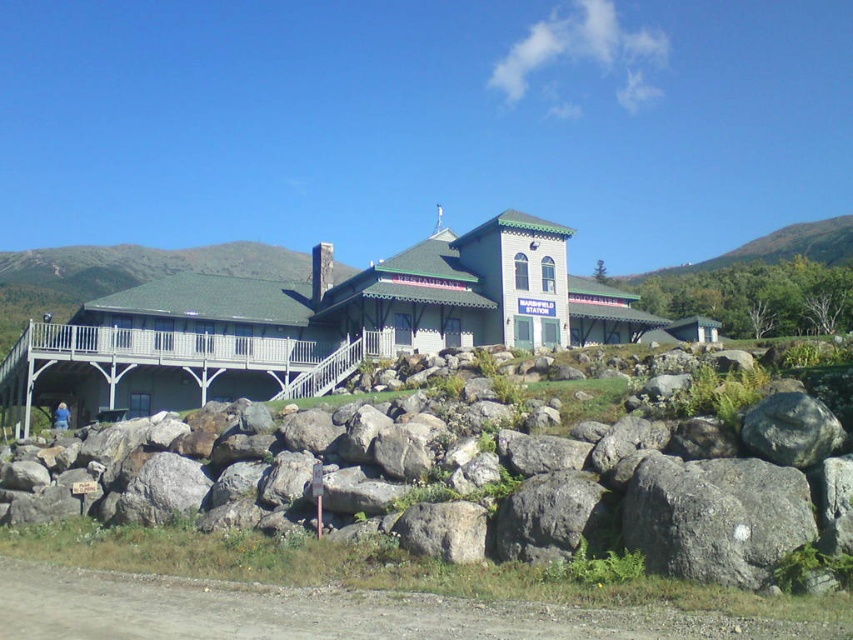
Question: Does gray rock at center have a smaller size compared to white wooden porch at upper left?

Choices:
 (A) no
 (B) yes

Answer: (A)

Question: Is the position of gray rock at center less distant than that of wooden porch at center?

Choices:
 (A) yes
 (B) no

Answer: (A)

Question: Which of these objects is positioned farthest from the wooden porch at center?

Choices:
 (A) white wooden porch at upper left
 (B) gray rock at center

Answer: (B)

Question: Among these objects, which one is farthest from the camera?

Choices:
 (A) gray rock at center
 (B) wooden porch at center
 (C) white wooden porch at upper left

Answer: (C)

Question: Which object is positioned farthest from the white wooden porch at upper left?

Choices:
 (A) gray rock at center
 (B) wooden porch at center

Answer: (A)

Question: Is gray rock at center bigger than white wooden porch at upper left?

Choices:
 (A) yes
 (B) no

Answer: (A)